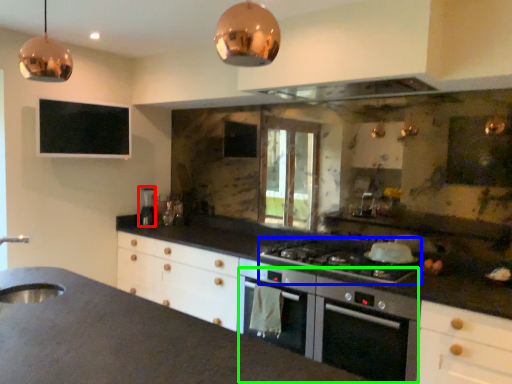
Question: Estimate the real-world distances between objects in this image. Which object is closer to appliance (highlighted by a red box), gas stove (highlighted by a blue box) or oven (highlighted by a green box)?

Choices:
 (A) gas stove
 (B) oven

Answer: (A)